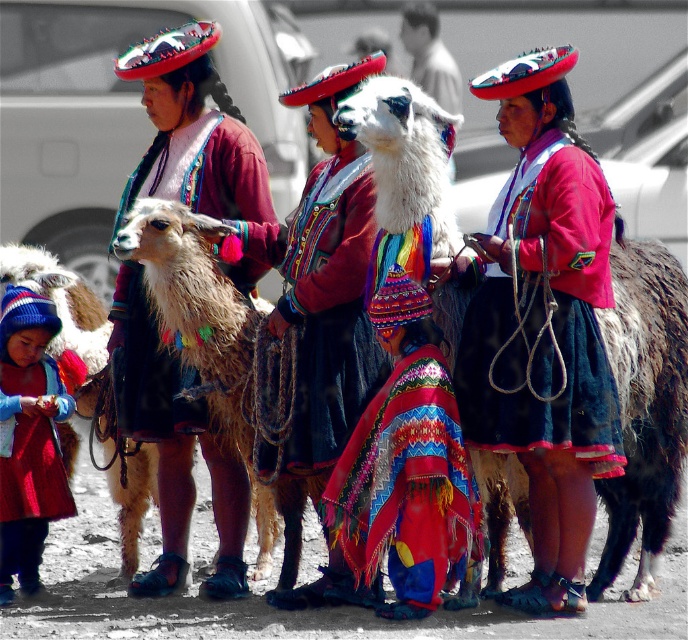
Is matte black skirt at center below white woolen sweater at upper center?

Correct, matte black skirt at center is located below white woolen sweater at upper center.

Can you confirm if matte black skirt at center is bigger than white woolen sweater at upper center?

No, matte black skirt at center is not bigger than white woolen sweater at upper center.

Which is behind, point (605, 433) or point (411, 20)?

The point (411, 20) is behind.

I want to click on matte black skirt at center, so point(544,324).

Does multicolored woven poncho at center have a larger size compared to white woolen llama at left?

Correct, multicolored woven poncho at center is larger in size than white woolen llama at left.

Which of these two, multicolored woven poncho at center or white woolen llama at left, stands shorter?

white woolen llama at left is shorter.

Does point (433, 355) come behind point (32, 246)?

No.

In order to click on multicolored woven poncho at center in this screenshot , I will do `click(407, 486)`.

Identify the location of multicolored woven fabric at center. (325, 307).

Between multicolored woven fabric at center and white woolen sweater at upper center, which one is positioned lower?

Positioned lower is multicolored woven fabric at center.

Who is more distant from viewer, (344, 332) or (431, 38)?

The point (431, 38) is behind.

Locate an element on the screen. The image size is (688, 640). multicolored woven fabric at center is located at coordinates (325, 307).